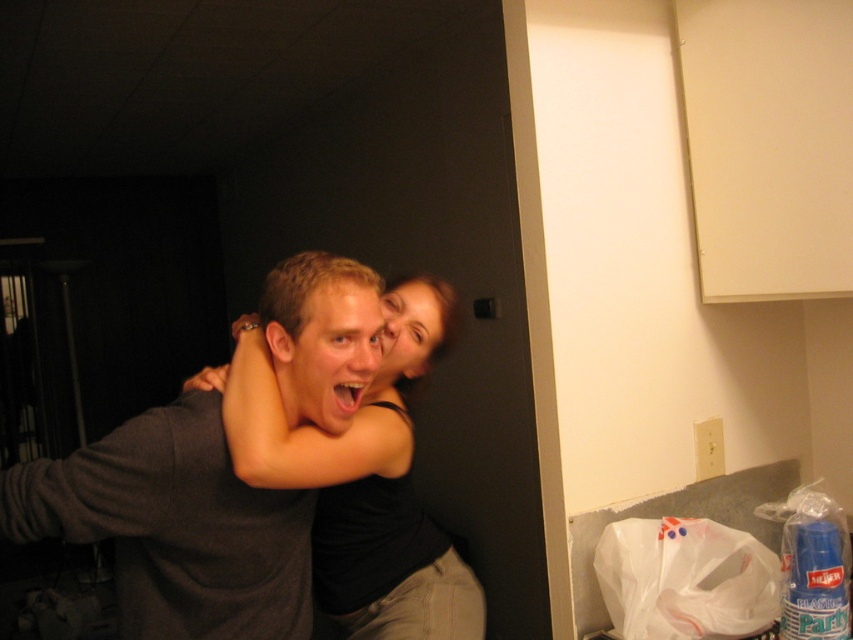
Describe the element at coordinates (175, 528) in the screenshot. I see `dark gray shirt at center` at that location.

Does dark gray shirt at center appear over black matte skin at center?

Correct, dark gray shirt at center is located above black matte skin at center.

Locate an element on the screen. The height and width of the screenshot is (640, 853). dark gray shirt at center is located at coordinates (175, 528).

Identify the location of dark gray shirt at center. This screenshot has width=853, height=640. (175, 528).